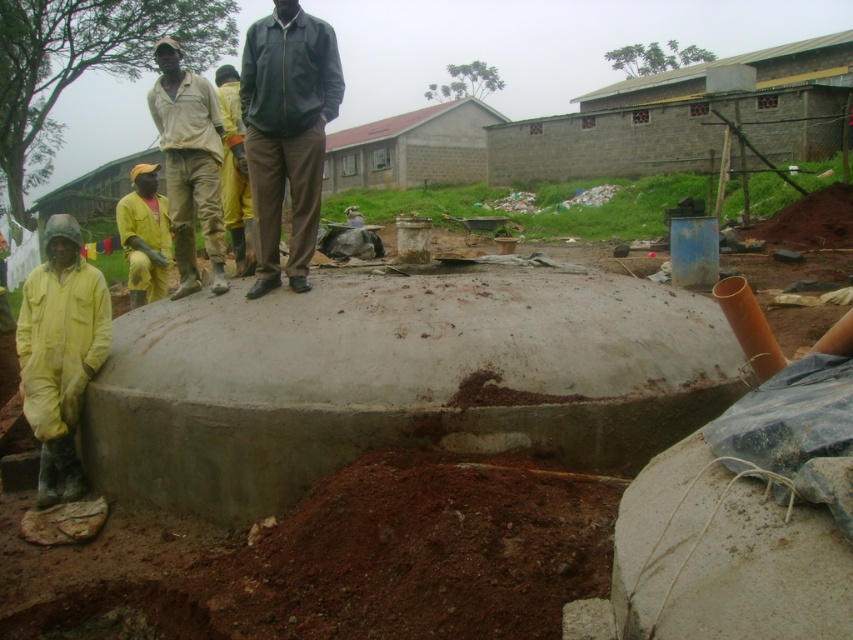
You are a safety inspector standing at the origin point of the construction site coordinates. You need to locate the worker wearing the light beige fabric shirt at center. What are the coordinates of this worker?

The coordinates of the light beige fabric shirt at center are at point (189, 164).

You are a safety inspector at the construction site and need to locate the worker in the yellow rubber suit at lower left. Which direction should you look from the dark green jacket at center to find them?

The dark green jacket at center is to the right of the yellow rubber suit at lower left, so you should look to the left from the dark green jacket at center to find the yellow rubber suit at lower left.